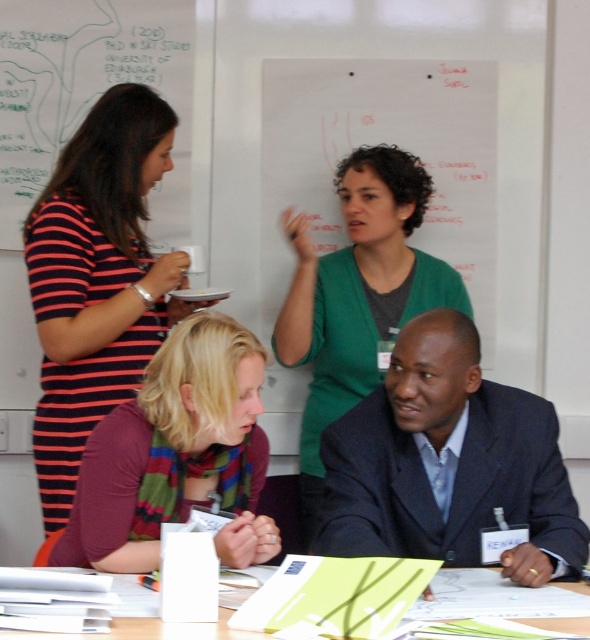
You are organizing a meeting and need to retrieve the green paper at lower center. Can you reach it without moving the green matte sweater at upper center?

The green matte sweater at upper center is positioned over the green paper at lower center, so you cannot reach the green paper at lower center without moving the green matte sweater at upper center.

You are sitting at the table in the scene and want to hand a document to the person wearing the dark blue suit at center and the multicolored scarf at center. Which person is closer to your left side?

The multicolored scarf at center is to the left of the dark blue suit at center, so the person wearing the multicolored scarf at center is closer to your left side.